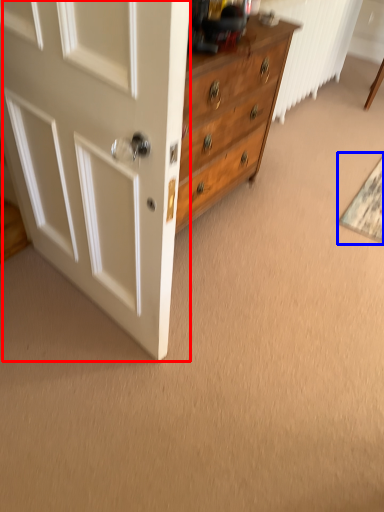
Question: Which point is further to the camera, door (highlighted by a red box) or doormat (highlighted by a blue box)?

Choices:
 (A) door
 (B) doormat

Answer: (B)